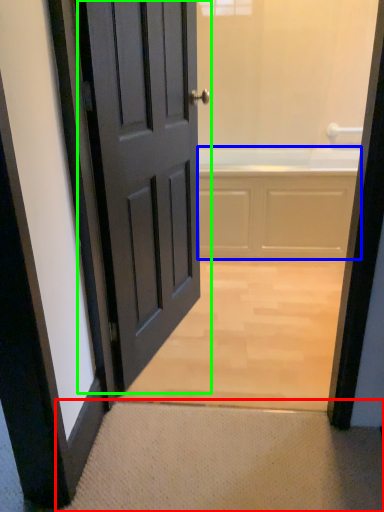
Question: Considering the real-world distances, which object is closest to doormat (highlighted by a red box)? bath (highlighted by a blue box) or door (highlighted by a green box).

Choices:
 (A) bath
 (B) door

Answer: (B)